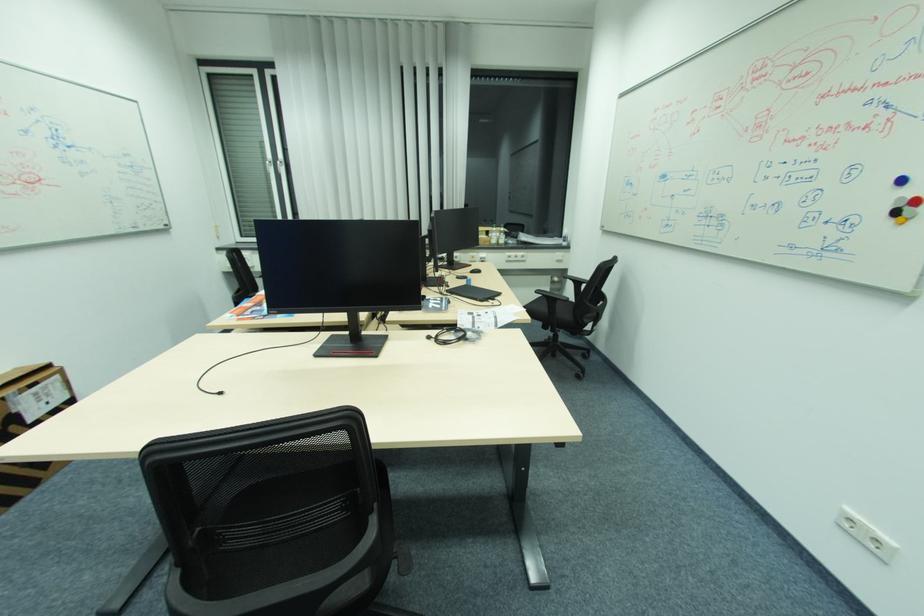
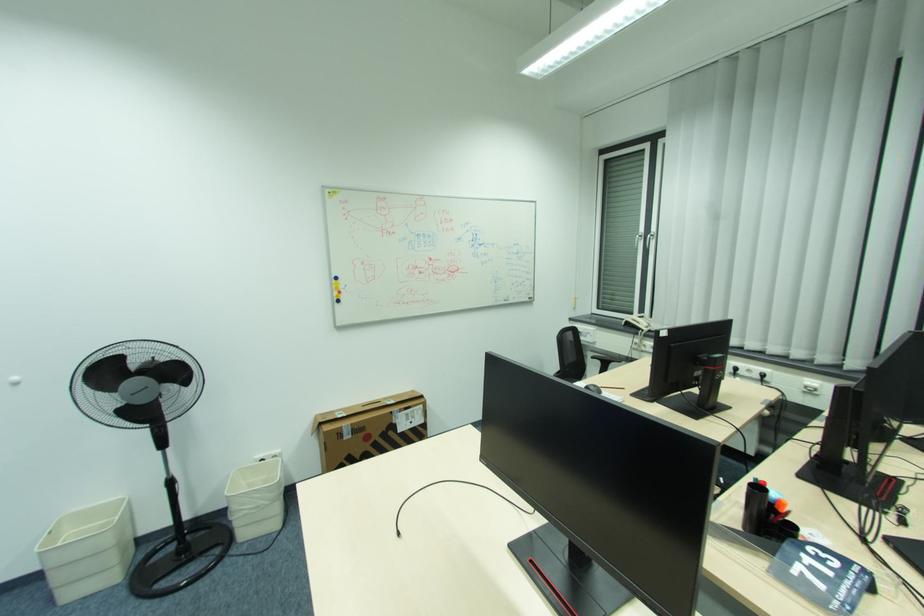
Where in the second image is the point corresponding to point (285, 163) from the first image?

(653, 236)